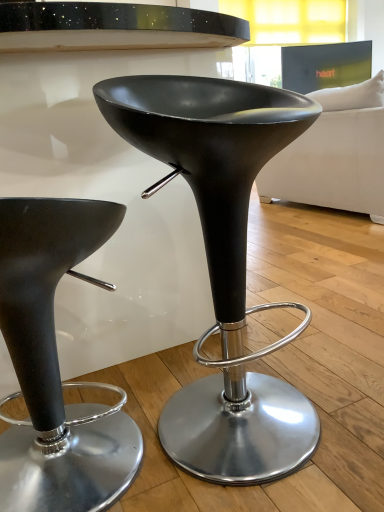
Question: From a real-world perspective, is matte black stool at center, positioned as the 2th stool in left-to-right order, above or below matte black stool at center, the 1th stool in the left-to-right sequence?

Choices:
 (A) above
 (B) below

Answer: (A)

Question: From the image's perspective, is matte black stool at center, positioned as the 2th stool in left-to-right order, positioned above or below matte black stool at center, the second stool in the right-to-left sequence?

Choices:
 (A) above
 (B) below

Answer: (A)

Question: Based on their relative distances, which object is farther from the matte black stool at center, the 1th stool in the left-to-right sequence?

Choices:
 (A) matte black stool at center, which is the first stool from right to left
 (B) white fabric couch at upper right

Answer: (B)

Question: Which of these objects is positioned farthest from the matte black stool at center, the second stool in the right-to-left sequence?

Choices:
 (A) matte black stool at center, positioned as the 2th stool in left-to-right order
 (B) white fabric couch at upper right

Answer: (B)